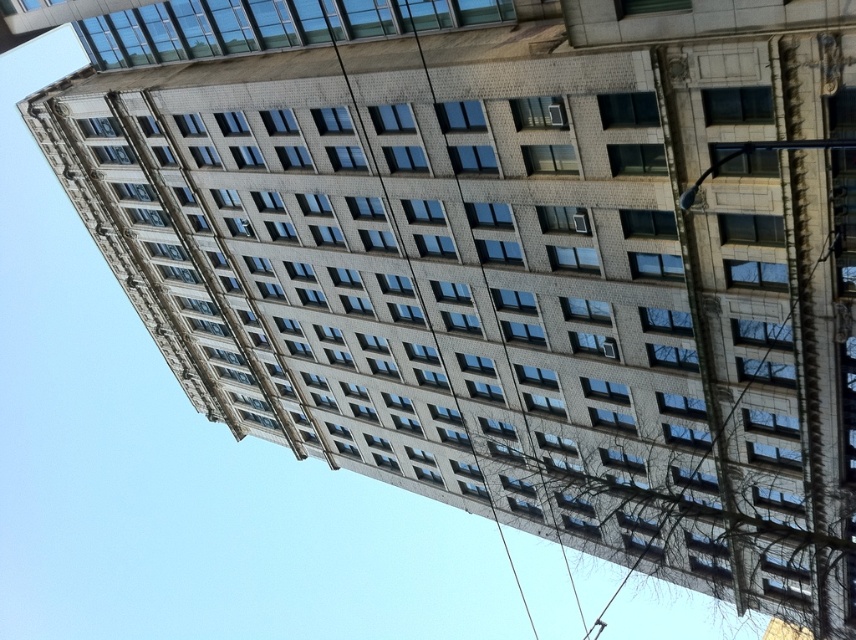
Question: Can you confirm if metallic wire at upper right is wider than smooth wire at center?

Choices:
 (A) yes
 (B) no

Answer: (B)

Question: Does metallic wire at upper right have a smaller size compared to smooth wire at center?

Choices:
 (A) yes
 (B) no

Answer: (A)

Question: Which of the following is the farthest from the observer?

Choices:
 (A) (646, 529)
 (B) (364, 138)

Answer: (A)

Question: Which point is closer to the camera taking this photo?

Choices:
 (A) (786, 493)
 (B) (473, 448)

Answer: (A)

Question: Is metallic wire at upper right behind smooth wire at center?

Choices:
 (A) yes
 (B) no

Answer: (B)

Question: Among these points, which one is nearest to the camera?

Choices:
 (A) (610, 280)
 (B) (440, 360)

Answer: (A)